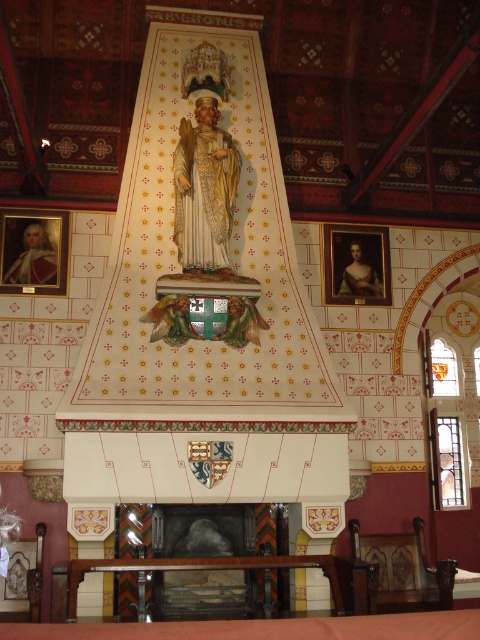
You are an interior designer assessing the symmetry of the mantel area. You notice two matte gold frames above the mantel. The first is the matte gold frame at upper left and the second is the matte gold portrait at upper right. Which of these two items has a smaller width?

The matte gold frame at upper left has a lesser width compared to the matte gold portrait at upper right, so the matte gold frame at upper left is smaller in width.

You are an interior designer assessing the space. You need to determine which object takes up more visual space in the scene between the dark gray stone fireplace at center and the matte gold portrait at upper right. Which one is larger in size?

The dark gray stone fireplace at center occupies less space than matte gold portrait at upper right, so the matte gold portrait at upper right is larger in size.

You are an interior designer planning to hang a new painting. You have the dark gray stone fireplace at center and the matte gold frame at upper left in view. Which object is located below the other?

The dark gray stone fireplace at center is positioned under the matte gold frame at upper left, so the fireplace is below the frame.